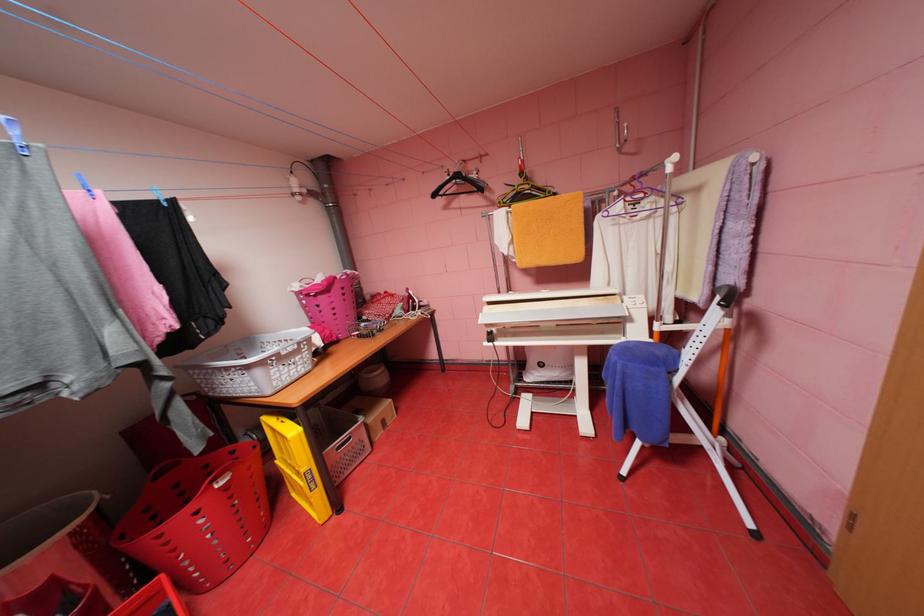
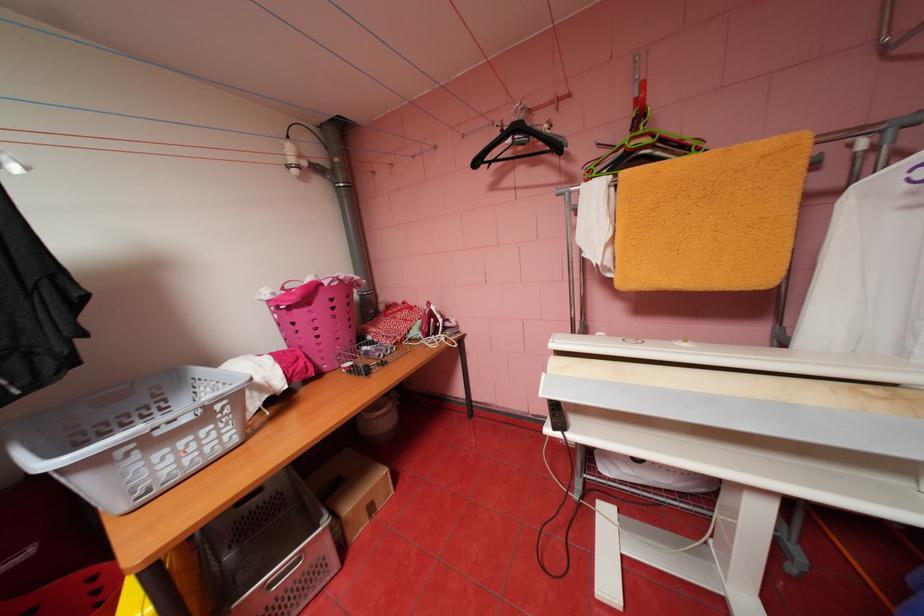
Where in the second image is the point corresponding to the point at 393,422 from the first image?

(380, 508)